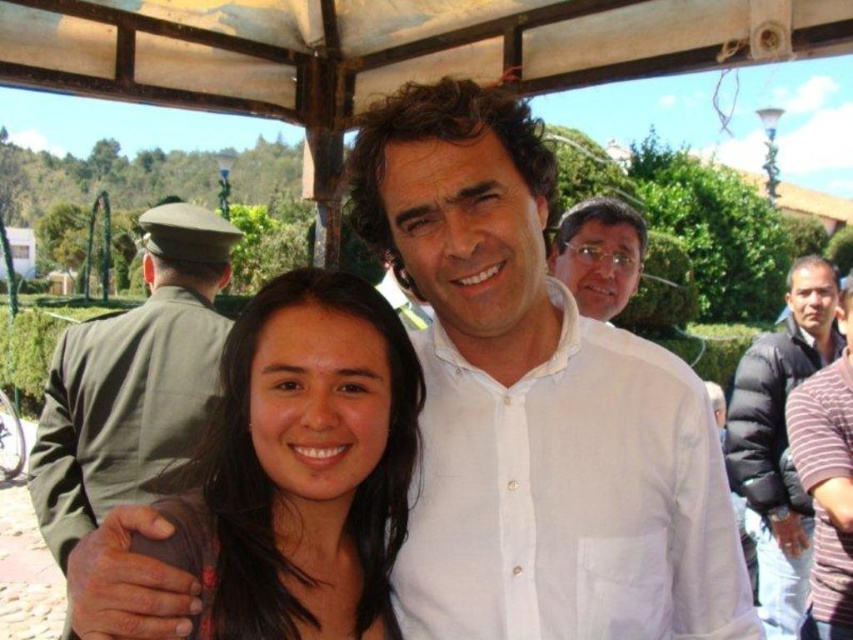
Does black puffy jacket at right appear on the left side of matte white shirt at upper center?

In fact, black puffy jacket at right is to the right of matte white shirt at upper center.

Which is in front, point (782, 337) or point (631, 220)?

Point (631, 220) is in front.

Find the location of a particular element. This screenshot has height=640, width=853. black puffy jacket at right is located at coordinates [x=779, y=440].

Is the position of white linen shirt at center more distant than that of brown hair at center?

Yes, it is.

Between white linen shirt at center and brown hair at center, which one has less height?

With less height is brown hair at center.

The height and width of the screenshot is (640, 853). Identify the location of white linen shirt at center. (535, 406).

Identify the location of white linen shirt at center. This screenshot has height=640, width=853. (535, 406).

Who is positioned more to the right, white linen shirt at center or matte white shirt at upper center?

matte white shirt at upper center is more to the right.

Which is behind, point (430, 545) or point (555, 268)?

The point (555, 268) is more distant.

Identify the location of white linen shirt at center. This screenshot has width=853, height=640. pyautogui.click(x=535, y=406).